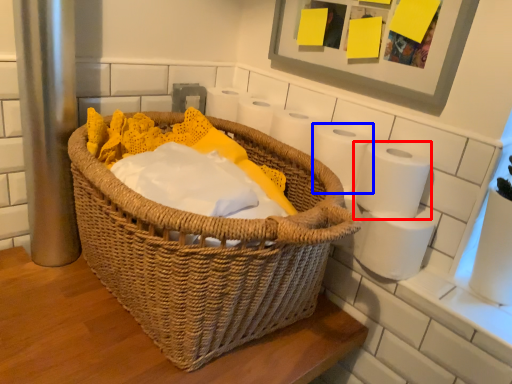
Question: Which object appears closest to the camera in this image, toilet paper (highlighted by a red box) or toilet paper (highlighted by a blue box)?

Choices:
 (A) toilet paper
 (B) toilet paper

Answer: (A)